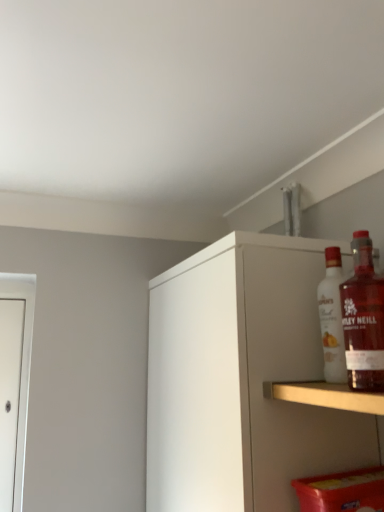
Question: Is translucent glass bottle at upper right, the 1th bottle viewed from the front, thinner than white glass bottle at upper right, the first bottle when ordered from back to front?

Choices:
 (A) no
 (B) yes

Answer: (A)

Question: From the image's perspective, does translucent glass bottle at upper right, which ranks as the 2th bottle in back-to-front order, appear lower than white glass bottle at upper right, which appears as the second bottle when viewed from the front?

Choices:
 (A) yes
 (B) no

Answer: (B)

Question: Does translucent glass bottle at upper right, which ranks as the 2th bottle in back-to-front order, have a smaller size compared to white glass bottle at upper right, which appears as the second bottle when viewed from the front?

Choices:
 (A) no
 (B) yes

Answer: (A)

Question: Considering the relative positions of translucent glass bottle at upper right, which ranks as the 2th bottle in back-to-front order, and white glass bottle at upper right, which appears as the second bottle when viewed from the front, in the image provided, is translucent glass bottle at upper right, which ranks as the 2th bottle in back-to-front order, in front of white glass bottle at upper right, which appears as the second bottle when viewed from the front,?

Choices:
 (A) yes
 (B) no

Answer: (A)

Question: Is translucent glass bottle at upper right, which ranks as the 2th bottle in back-to-front order, bigger than white glass bottle at upper right, the first bottle when ordered from back to front?

Choices:
 (A) no
 (B) yes

Answer: (B)

Question: Considering their positions, is white glass bottle at upper right, which appears as the second bottle when viewed from the front, located in front of or behind white matte cabinet at upper right?

Choices:
 (A) front
 (B) behind

Answer: (B)

Question: In terms of size, does white glass bottle at upper right, the first bottle when ordered from back to front, appear bigger or smaller than white matte cabinet at upper right?

Choices:
 (A) small
 (B) big

Answer: (A)

Question: Would you say white glass bottle at upper right, the first bottle when ordered from back to front, is inside or outside white matte cabinet at upper right?

Choices:
 (A) outside
 (B) inside

Answer: (A)

Question: Would you say white glass bottle at upper right, which appears as the second bottle when viewed from the front, is to the left or to the right of white matte cabinet at upper right in the picture?

Choices:
 (A) right
 (B) left

Answer: (A)

Question: Considering the relative positions of translucent glass bottle at upper right, the 1th bottle viewed from the front, and white matte cabinet at upper right in the image provided, is translucent glass bottle at upper right, the 1th bottle viewed from the front, to the left or to the right of white matte cabinet at upper right?

Choices:
 (A) right
 (B) left

Answer: (A)

Question: Is translucent glass bottle at upper right, which ranks as the 2th bottle in back-to-front order, spatially inside white matte cabinet at upper right, or outside of it?

Choices:
 (A) outside
 (B) inside

Answer: (A)

Question: From their relative heights in the image, would you say translucent glass bottle at upper right, the 1th bottle viewed from the front, is taller or shorter than white matte cabinet at upper right?

Choices:
 (A) short
 (B) tall

Answer: (A)

Question: Looking at the image, does translucent glass bottle at upper right, the 1th bottle viewed from the front, seem bigger or smaller compared to white matte cabinet at upper right?

Choices:
 (A) big
 (B) small

Answer: (B)

Question: From their relative heights in the image, would you say white matte cabinet at upper right is taller or shorter than translucent glass bottle at upper right, the 1th bottle viewed from the front?

Choices:
 (A) short
 (B) tall

Answer: (B)

Question: From a real-world perspective, is white matte cabinet at upper right positioned above or below translucent glass bottle at upper right, which ranks as the 2th bottle in back-to-front order?

Choices:
 (A) above
 (B) below

Answer: (B)